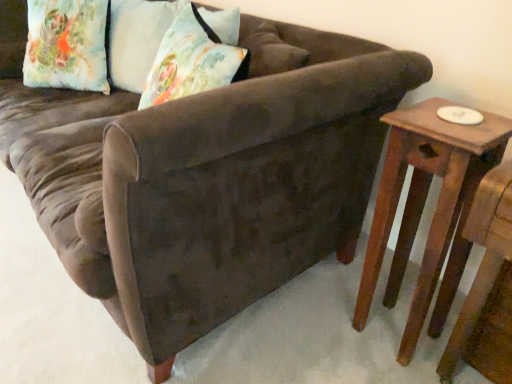
Find the location of a particular element. The height and width of the screenshot is (384, 512). free spot to the left of wooden side table at right is located at coordinates (323, 328).